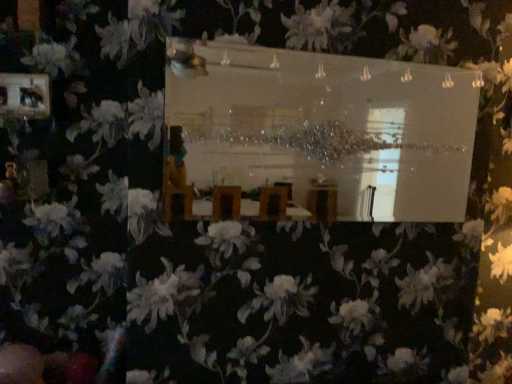
Question: Is matte black picture frame at upper left completely or partially outside of clear glass mirror at center?

Choices:
 (A) yes
 (B) no

Answer: (A)

Question: Would you say clear glass mirror at center is part of matte black picture frame at upper left's contents?

Choices:
 (A) no
 (B) yes

Answer: (A)

Question: Would you consider matte black picture frame at upper left to be distant from clear glass mirror at center?

Choices:
 (A) no
 (B) yes

Answer: (B)

Question: Is matte black picture frame at upper left touching clear glass mirror at center?

Choices:
 (A) yes
 (B) no

Answer: (B)

Question: Is matte black picture frame at upper left further to camera compared to clear glass mirror at center?

Choices:
 (A) no
 (B) yes

Answer: (B)

Question: Can you confirm if matte black picture frame at upper left is positioned to the right of clear glass mirror at center?

Choices:
 (A) yes
 (B) no

Answer: (B)

Question: Considering the relative positions of clear glass mirror at center and matte black picture frame at upper left in the image provided, is clear glass mirror at center in front of matte black picture frame at upper left?

Choices:
 (A) yes
 (B) no

Answer: (A)

Question: Can you confirm if clear glass mirror at center is positioned to the right of matte black picture frame at upper left?

Choices:
 (A) yes
 (B) no

Answer: (A)

Question: Is clear glass mirror at center not within matte black picture frame at upper left?

Choices:
 (A) yes
 (B) no

Answer: (A)

Question: Is clear glass mirror at center facing away from matte black picture frame at upper left?

Choices:
 (A) no
 (B) yes

Answer: (A)

Question: Does clear glass mirror at center have a lesser height compared to matte black picture frame at upper left?

Choices:
 (A) no
 (B) yes

Answer: (A)

Question: From the image's perspective, is clear glass mirror at center located beneath matte black picture frame at upper left?

Choices:
 (A) yes
 (B) no

Answer: (A)

Question: In the image, is clear glass mirror at center positioned in front of or behind matte black picture frame at upper left?

Choices:
 (A) front
 (B) behind

Answer: (A)